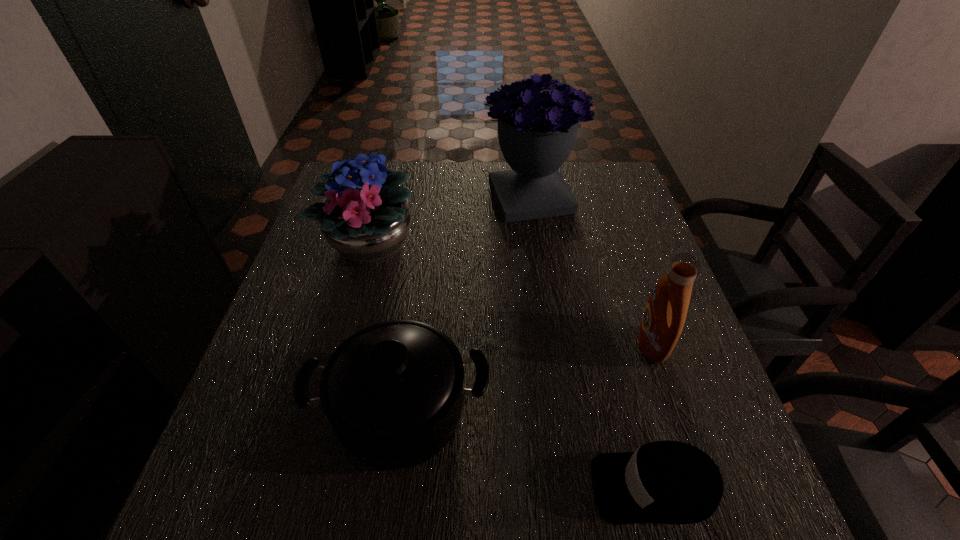
This screenshot has width=960, height=540. What are the coordinates of `free spot located on the back of the left bouquet` in the screenshot? It's located at (386, 188).

Where is `free space located on the back of the saucepan`? free space located on the back of the saucepan is located at coordinates click(425, 242).

At what (x,y) coordinates should I click in order to perform the action: click on free location located 0.250m on the front-facing side of the shortest object. Please return your answer as a coordinate pair (x, y). Looking at the image, I should click on (441, 487).

You are a GUI agent. You are given a task and a screenshot of the screen. Output one action in this format:
    pyautogui.click(x=<x>, y=<y>)
    Task: Click on the blank space located on the front-facing side of the shortest object
    This screenshot has height=540, width=960.
    Given the screenshot: What is the action you would take?
    pyautogui.click(x=392, y=487)

Where is `blank space located on the front-facing side of the shortest object`? blank space located on the front-facing side of the shortest object is located at coordinates (465, 487).

In order to click on object that is positioned at the far edge in this screenshot , I will do `click(537, 130)`.

Find the location of a particular element. This screenshot has width=960, height=540. saucepan present at the near edge is located at coordinates (393, 392).

The image size is (960, 540). What are the coordinates of `cap located at the near edge` in the screenshot? It's located at (667, 482).

Find the location of `bouquet positioned at the left edge`. bouquet positioned at the left edge is located at coordinates (365, 217).

I want to click on saucepan at the left edge, so click(x=393, y=392).